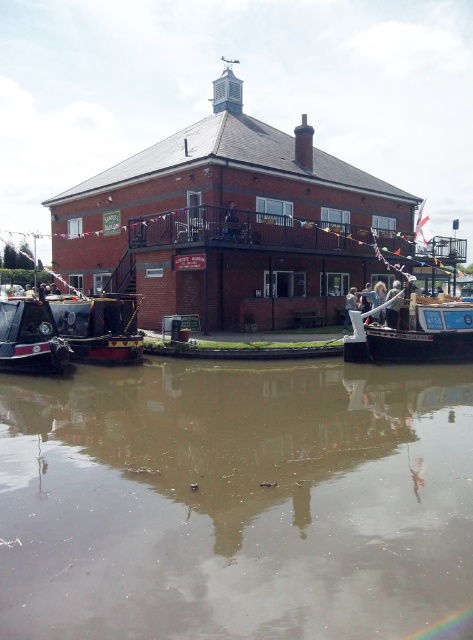
Question: Which of the following is the farthest from the observer?

Choices:
 (A) (399, 333)
 (B) (16, 316)
 (C) (131, 324)
 (D) (45, 483)

Answer: (C)

Question: Among these points, which one is farthest from the camera?

Choices:
 (A) (79, 358)
 (B) (396, 349)
 (C) (29, 371)
 (D) (29, 541)

Answer: (A)

Question: Which point is closer to the camera?

Choices:
 (A) (402, 346)
 (B) (25, 339)

Answer: (B)

Question: Can you confirm if wooden polished boat at center is smaller than matte black barge at left?

Choices:
 (A) yes
 (B) no

Answer: (B)

Question: In this image, where is wooden polished boat at center located relative to matte black boat at left?

Choices:
 (A) left
 (B) right

Answer: (B)

Question: Can you confirm if brown murky water at center is positioned to the left of wooden polished boat at center?

Choices:
 (A) no
 (B) yes

Answer: (B)